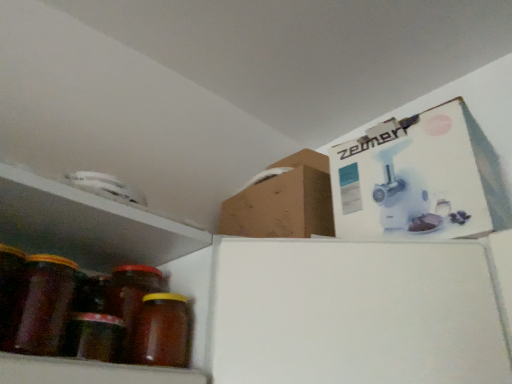
Question: Considering the relative sizes of brown matte jar at left, marked as the 1th bottle in a left-to-right arrangement, and brown matte jar at lower left, the 2th bottle in the left-to-right sequence, in the image provided, is brown matte jar at left, marked as the 1th bottle in a left-to-right arrangement, shorter than brown matte jar at lower left, the 2th bottle in the left-to-right sequence,?

Choices:
 (A) yes
 (B) no

Answer: (B)

Question: Can you confirm if brown matte jar at left, marked as the 1th bottle in a left-to-right arrangement, is positioned to the left of brown matte jar at lower left, the first bottle from the right?

Choices:
 (A) yes
 (B) no

Answer: (A)

Question: Is brown matte jar at left, which is counted as the second bottle, starting from the right, bigger than brown matte jar at lower left, the first bottle from the right?

Choices:
 (A) yes
 (B) no

Answer: (A)

Question: Can you confirm if brown matte jar at left, marked as the 1th bottle in a left-to-right arrangement, is taller than brown matte jar at lower left, the first bottle from the right?

Choices:
 (A) no
 (B) yes

Answer: (B)

Question: Considering the relative sizes of brown matte jar at left, marked as the 1th bottle in a left-to-right arrangement, and brown matte jar at lower left, the 2th bottle in the left-to-right sequence, in the image provided, is brown matte jar at left, marked as the 1th bottle in a left-to-right arrangement, smaller than brown matte jar at lower left, the 2th bottle in the left-to-right sequence,?

Choices:
 (A) no
 (B) yes

Answer: (A)

Question: Is brown matte jar at left, marked as the 1th bottle in a left-to-right arrangement, far away from brown matte jar at lower left, the first bottle from the right?

Choices:
 (A) no
 (B) yes

Answer: (A)

Question: Considering the relative sizes of brown matte jar at lower left, the first bottle from the right, and translucent amber glass jar at lower left in the image provided, is brown matte jar at lower left, the first bottle from the right, bigger than translucent amber glass jar at lower left?

Choices:
 (A) yes
 (B) no

Answer: (B)

Question: Can you confirm if brown matte jar at lower left, the first bottle from the right, is positioned to the right of translucent amber glass jar at lower left?

Choices:
 (A) no
 (B) yes

Answer: (B)

Question: Is brown matte jar at lower left, the first bottle from the right, positioned beyond the bounds of translucent amber glass jar at lower left?

Choices:
 (A) no
 (B) yes

Answer: (B)

Question: From the image's perspective, is brown matte jar at lower left, the 2th bottle in the left-to-right sequence, beneath translucent amber glass jar at lower left?

Choices:
 (A) no
 (B) yes

Answer: (B)

Question: Is brown matte jar at lower left, the first bottle from the right, positioned before translucent amber glass jar at lower left?

Choices:
 (A) yes
 (B) no

Answer: (B)

Question: Does brown matte jar at lower left, the 2th bottle in the left-to-right sequence, have a lesser height compared to translucent amber glass jar at lower left?

Choices:
 (A) yes
 (B) no

Answer: (A)

Question: Is brown matte jar at left, which is counted as the second bottle, starting from the right, facing away from translucent amber glass jar at lower left?

Choices:
 (A) no
 (B) yes

Answer: (A)